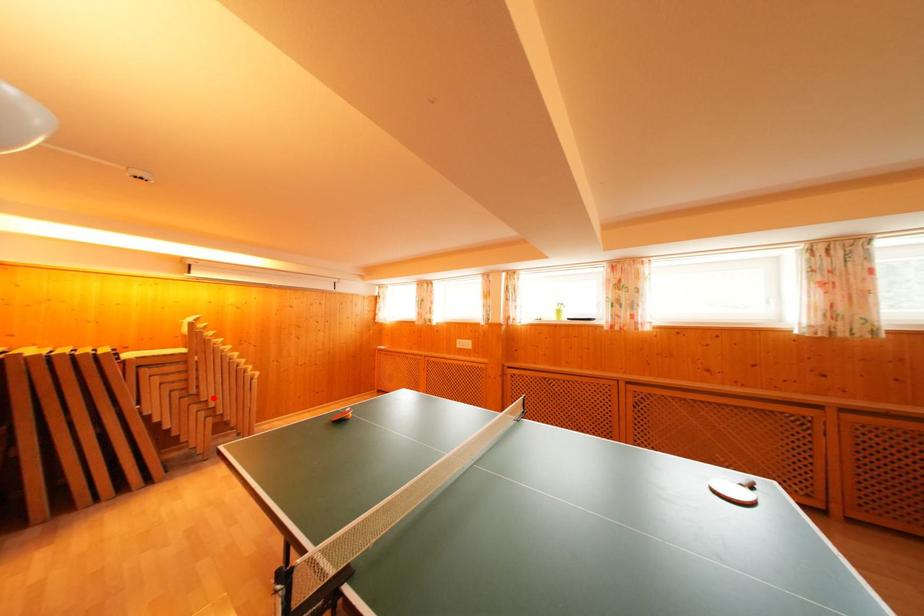
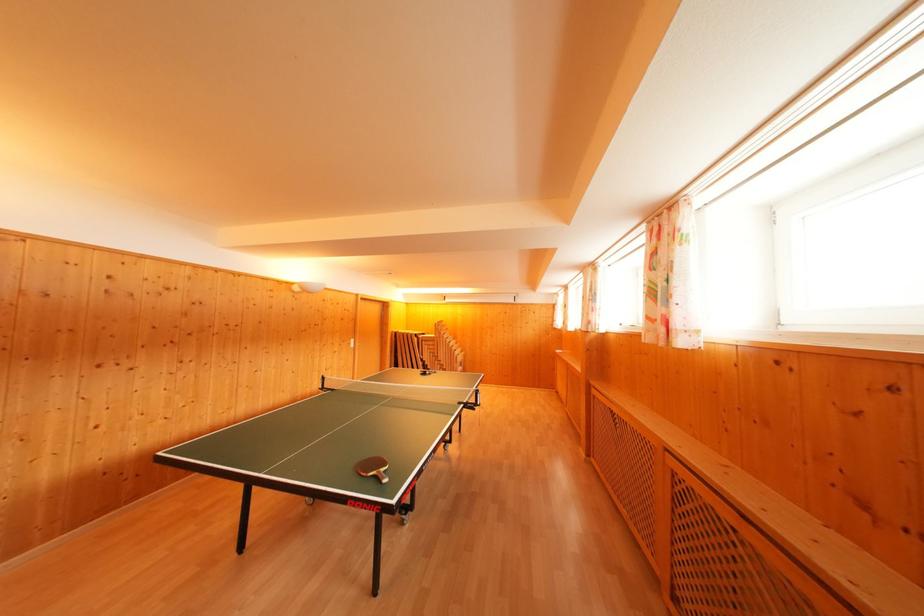
The point at the highlighted location is marked in the first image. Where is the corresponding point in the second image?

(445, 362)